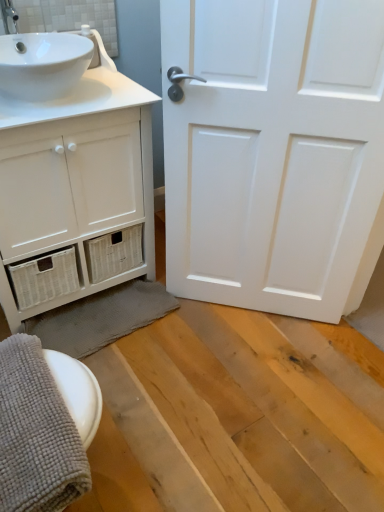
This screenshot has height=512, width=384. I want to click on free space above gray textured bath towel at lower left, which is the first bath towel in front-to-back order (from a real-world perspective), so coord(25,392).